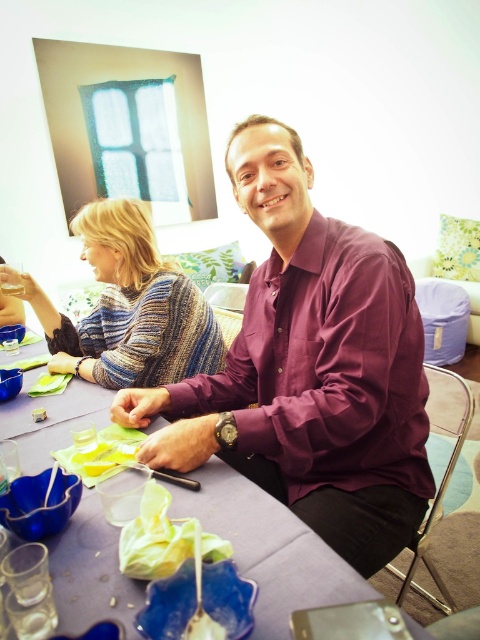
Question: Based on their relative distances, which object is nearer to the purple matte shirt at center?

Choices:
 (A) translucent yellow paper at table center
 (B) knitted sweater at upper left

Answer: (A)

Question: Can you confirm if translucent yellow paper at table center is positioned below yellow plastic bag at table?

Choices:
 (A) yes
 (B) no

Answer: (A)

Question: From the image, what is the correct spatial relationship of knitted sweater at upper left in relation to translucent yellow paper at table center?

Choices:
 (A) below
 (B) above

Answer: (B)

Question: Can you confirm if purple matte shirt at center is bigger than translucent yellow paper at table center?

Choices:
 (A) no
 (B) yes

Answer: (B)

Question: Which is nearer to the yellow plastic bag at table?

Choices:
 (A) knitted sweater at upper left
 (B) purple fabric table at center
 (C) purple matte shirt at center
 (D) translucent yellow paper at table center

Answer: (B)

Question: Which of the following is the farthest from the observer?

Choices:
 (A) yellow plastic bag at table
 (B) translucent yellow paper at table center
 (C) knitted sweater at upper left

Answer: (C)